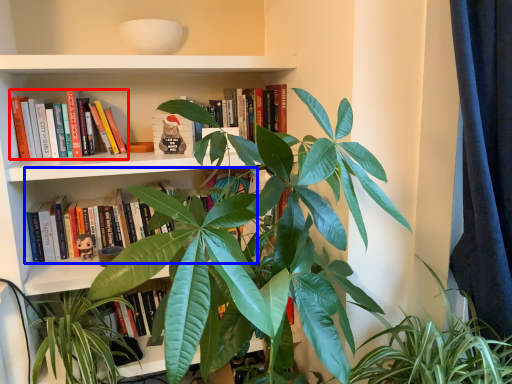
Question: Which object appears closest to the camera in this image, book (highlighted by a red box) or book (highlighted by a blue box)?

Choices:
 (A) book
 (B) book

Answer: (A)